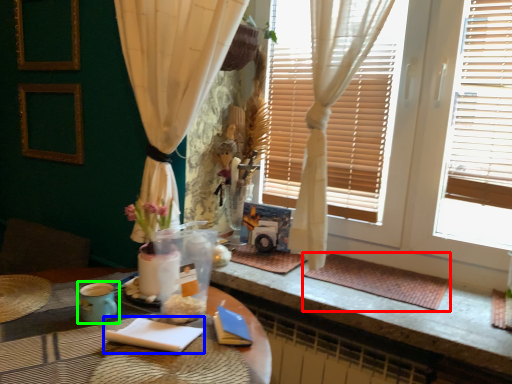
Question: Which object is positioned closest to wide (highlighted by a red box)? Select from notepad (highlighted by a blue box) and teal (highlighted by a green box).

Choices:
 (A) notepad
 (B) teal

Answer: (A)